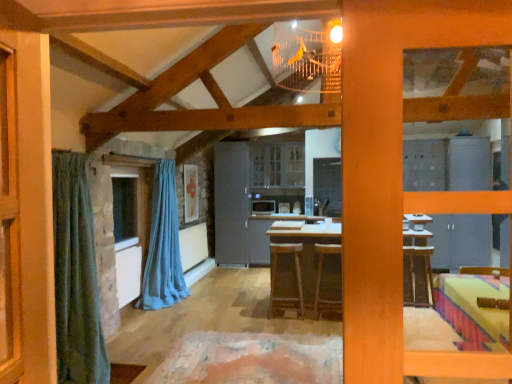
Locate an element on the screen. The image size is (512, 384). free space in front of brown wooden stool at center, which ranks as the 2th stool in right-to-left order is located at coordinates point(285,325).